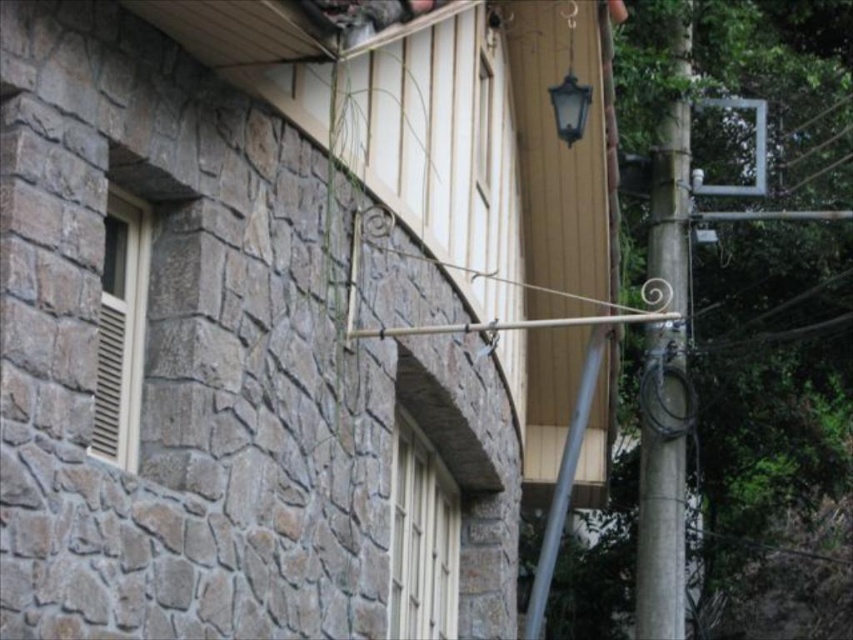
Is smooth gray pole at right thinner than beige wooden window at left?

In fact, smooth gray pole at right might be wider than beige wooden window at left.

The height and width of the screenshot is (640, 853). What do you see at coordinates (660, 484) in the screenshot?
I see `smooth gray pole at right` at bounding box center [660, 484].

Is point (650, 228) positioned after point (107, 387)?

Yes, point (650, 228) is behind point (107, 387).

At what (x,y) coordinates should I click in order to perform the action: click on smooth gray pole at right. Please return your answer as a coordinate pair (x, y). Image resolution: width=853 pixels, height=640 pixels. Looking at the image, I should click on (660, 484).

Can you confirm if smooth gray pole at right is positioned above white textured window at center?

Correct, smooth gray pole at right is located above white textured window at center.

Is point (648, 592) positioned behind point (393, 592)?

Yes, it is.

Where is `smooth gray pole at right`? The width and height of the screenshot is (853, 640). smooth gray pole at right is located at coordinates [x=660, y=484].

At what (x,y) coordinates should I click in order to perform the action: click on white textured window at center. Please return your answer as a coordinate pair (x, y). This screenshot has width=853, height=640. Looking at the image, I should click on (422, 538).

Between point (451, 522) and point (135, 220), which one is positioned behind?

Point (451, 522)

Locate an element on the screen. This screenshot has height=640, width=853. white textured window at center is located at coordinates (422, 538).